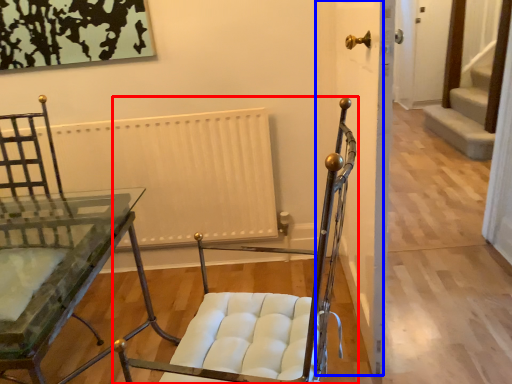
Question: Which object appears closest to the camera in this image, chair (highlighted by a red box) or door (highlighted by a blue box)?

Choices:
 (A) chair
 (B) door

Answer: (A)